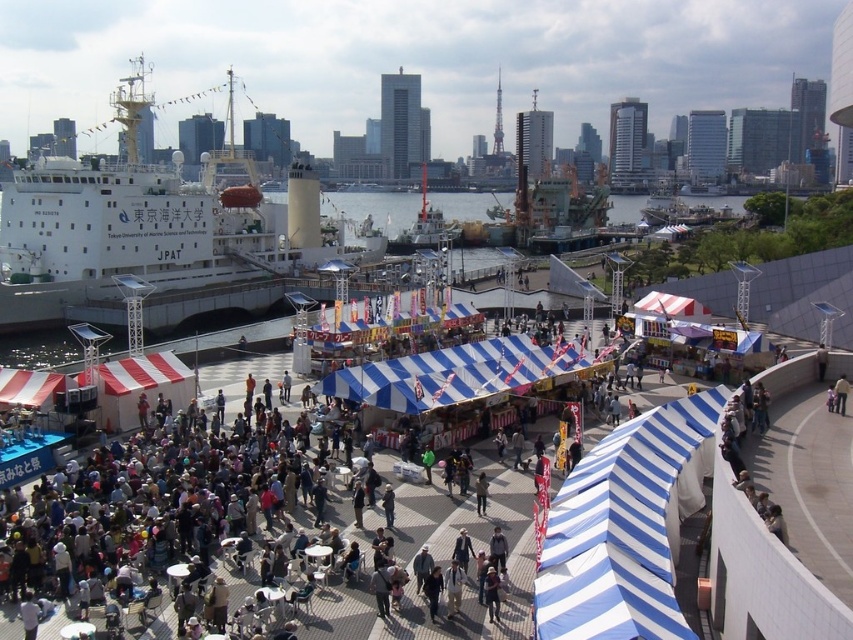
Question: Is white matte ship at left thinner than metallic gray ship at center?

Choices:
 (A) yes
 (B) no

Answer: (B)

Question: Is white matte ship at left to the left of metallic gray ship at center from the viewer's perspective?

Choices:
 (A) yes
 (B) no

Answer: (A)

Question: Can you confirm if white matte ship at left is positioned above metallic gray ship at center?

Choices:
 (A) yes
 (B) no

Answer: (B)

Question: Which object is farther from the camera taking this photo?

Choices:
 (A) metallic gray ship at center
 (B) white matte ship at left

Answer: (A)

Question: Which point appears closest to the camera in this image?

Choices:
 (A) (132, 241)
 (B) (415, 220)

Answer: (A)